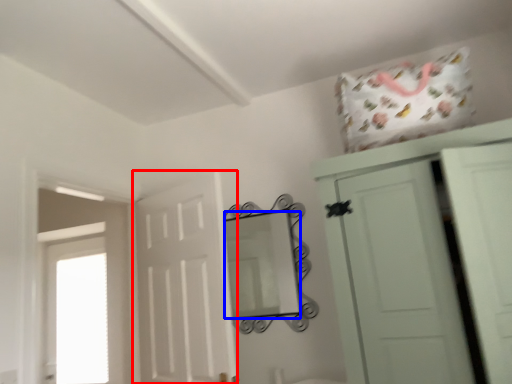
Question: Which object appears farthest to the camera in this image, door (highlighted by a red box) or mirror (highlighted by a blue box)?

Choices:
 (A) door
 (B) mirror

Answer: (B)